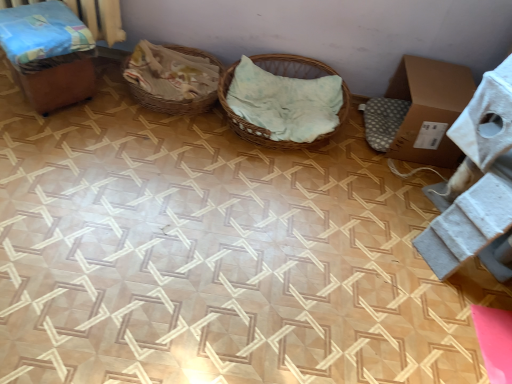
Question: Does brown cardboard box at right lie in front of wooden box at left?

Choices:
 (A) yes
 (B) no

Answer: (B)

Question: Is the surface of brown cardboard box at right in direct contact with wooden box at left?

Choices:
 (A) no
 (B) yes

Answer: (A)

Question: From a real-world perspective, is brown cardboard box at right positioned under wooden box at left based on gravity?

Choices:
 (A) yes
 (B) no

Answer: (A)

Question: Considering the relative sizes of brown cardboard box at right and wooden box at left in the image provided, is brown cardboard box at right smaller than wooden box at left?

Choices:
 (A) no
 (B) yes

Answer: (A)

Question: From the image's perspective, does brown cardboard box at right appear higher than wooden box at left?

Choices:
 (A) yes
 (B) no

Answer: (B)

Question: From the image's perspective, is brown cardboard box at right below wooden box at left?

Choices:
 (A) no
 (B) yes

Answer: (B)

Question: Is the position of wooden box at left less distant than that of woven brown basket at center, which ranks as the first basket in left-to-right order?

Choices:
 (A) yes
 (B) no

Answer: (A)

Question: Can you see wooden box at left touching woven brown basket at center, which ranks as the first basket in left-to-right order?

Choices:
 (A) yes
 (B) no

Answer: (B)

Question: Is wooden box at left to the left of woven brown basket at center, positioned as the second basket in right-to-left order, from the viewer's perspective?

Choices:
 (A) no
 (B) yes

Answer: (B)

Question: Considering the relative positions of wooden box at left and woven brown basket at center, positioned as the second basket in right-to-left order, in the image provided, is wooden box at left behind woven brown basket at center, positioned as the second basket in right-to-left order,?

Choices:
 (A) yes
 (B) no

Answer: (B)

Question: Is wooden box at left far from woven brown basket at center, positioned as the second basket in right-to-left order?

Choices:
 (A) yes
 (B) no

Answer: (B)

Question: Is wooden box at left not within woven brown basket at center, positioned as the second basket in right-to-left order?

Choices:
 (A) no
 (B) yes

Answer: (B)

Question: Is wooden box at left beside woven wood basket at center, the second basket viewed from the left?

Choices:
 (A) yes
 (B) no

Answer: (B)